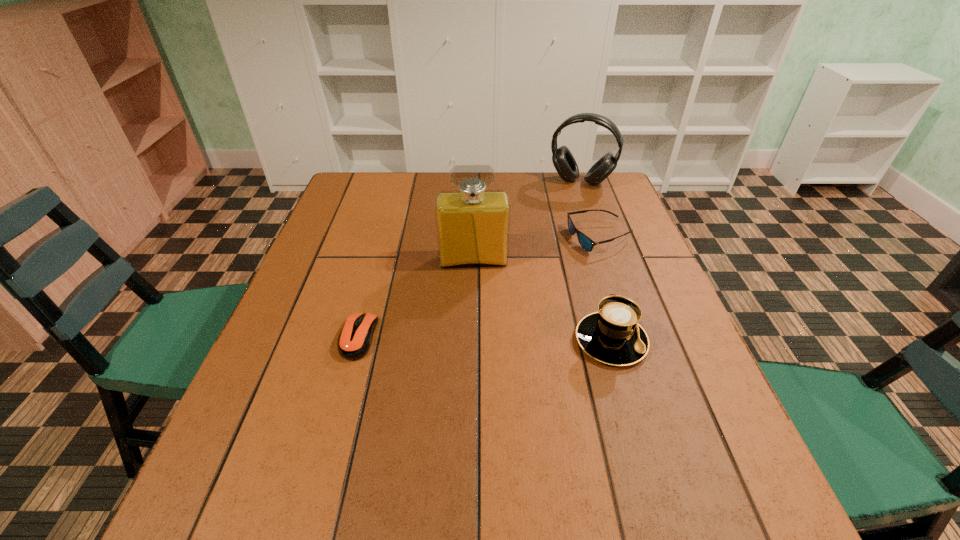
Locate an element on the screen. free space on the desktop that is between the shortest object and the cappuccino and is positioned on the front-facing side of the second object from left to right is located at coordinates (477, 339).

Locate an element on the screen. The image size is (960, 540). free space on the desktop that is between the leftmost object and the cappuccino and is positioned at the front of the sunglasses showing the lenses is located at coordinates (511, 340).

The height and width of the screenshot is (540, 960). I want to click on vacant space on the desktop that is between the leftmost object and the cappuccino and is positioned on the earcups of the headset, so click(522, 340).